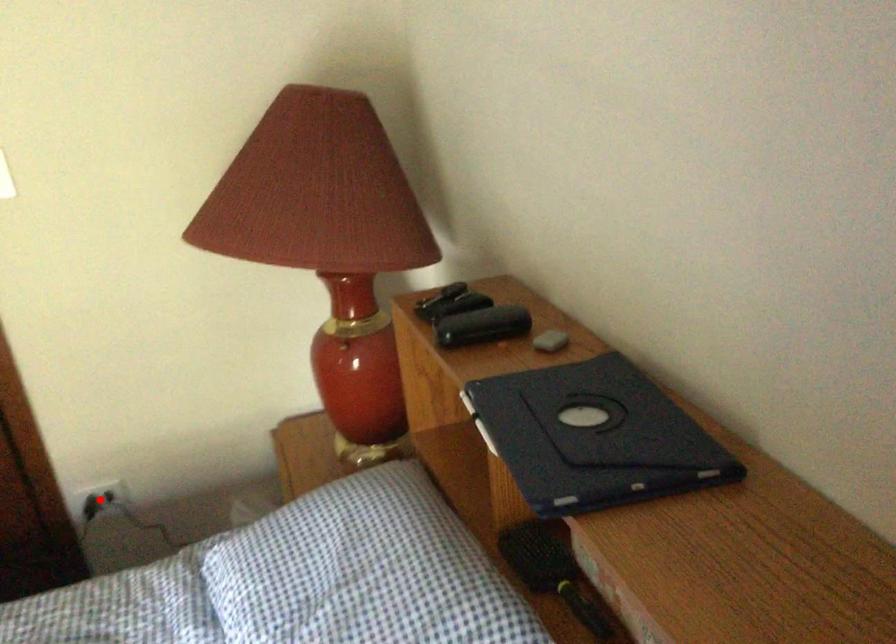
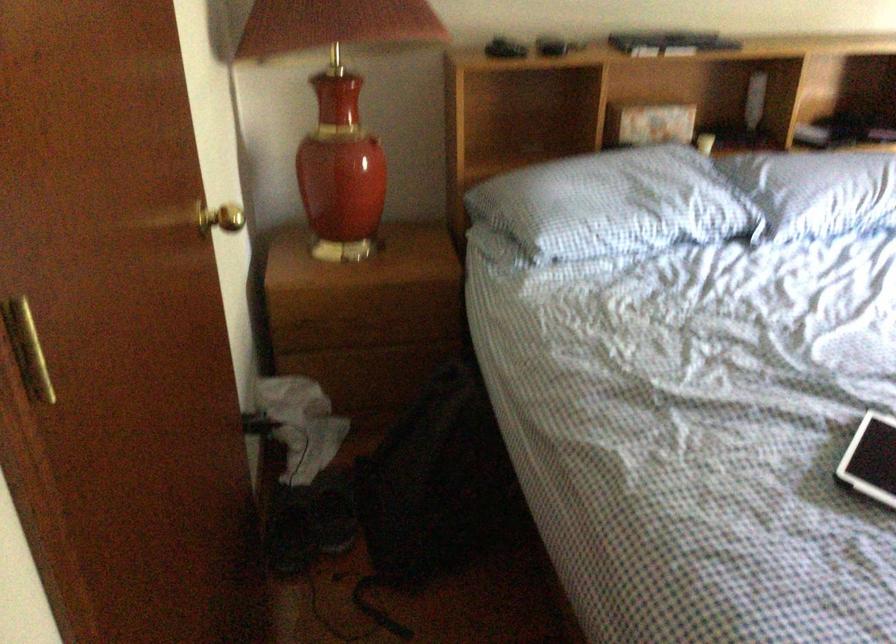
Question: I am providing you with two images of the same scene from different viewpoints. A red point is marked on the first image. Is the red point's position out of view in image 2?

Choices:
 (A) Yes
 (B) No

Answer: (A)